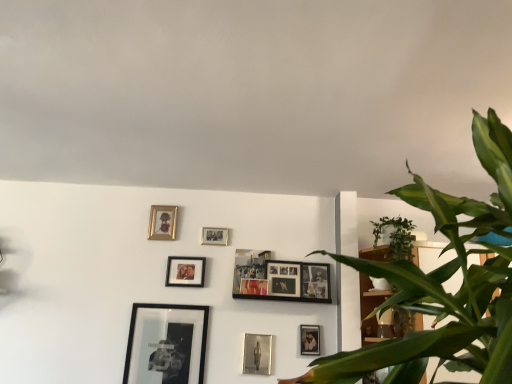
Question: Is matte black picture frame at center, which is the fifth picture frame in right-to-left order, with wooden frame at upper left, which appears as the 10th picture frame when viewed from the right?

Choices:
 (A) yes
 (B) no

Answer: (B)

Question: Is matte black picture frame at center, arranged as the 6th picture frame when viewed from the left, aimed at wooden frame at upper left, the first picture frame in the left-to-right sequence?

Choices:
 (A) yes
 (B) no

Answer: (B)

Question: Is matte black picture frame at center, which is the fifth picture frame in right-to-left order, oriented away from wooden frame at upper left, the first picture frame in the left-to-right sequence?

Choices:
 (A) no
 (B) yes

Answer: (A)

Question: Can you confirm if matte black picture frame at center, arranged as the 6th picture frame when viewed from the left, is thinner than wooden frame at upper left, the first picture frame in the left-to-right sequence?

Choices:
 (A) no
 (B) yes

Answer: (A)

Question: Can you confirm if matte black picture frame at center, arranged as the 6th picture frame when viewed from the left, is smaller than wooden frame at upper left, which appears as the 10th picture frame when viewed from the right?

Choices:
 (A) yes
 (B) no

Answer: (A)

Question: From a real-world perspective, relative to wooden frame at upper left, which appears as the 10th picture frame when viewed from the right, is matte black picture frame at center, which ranks as the 3th picture frame in left-to-right order, vertically above or below?

Choices:
 (A) above
 (B) below

Answer: (B)

Question: Does point (176, 279) appear closer or farther from the camera than point (159, 228)?

Choices:
 (A) farther
 (B) closer

Answer: (B)

Question: Considering their positions, is matte black picture frame at center, the eighth picture frame in the right-to-left sequence, located in front of or behind wooden frame at upper left, which appears as the 10th picture frame when viewed from the right?

Choices:
 (A) front
 (B) behind

Answer: (A)

Question: Visually, is matte black picture frame at center, which ranks as the 3th picture frame in left-to-right order, positioned to the left or to the right of wooden frame at upper left, the first picture frame in the left-to-right sequence?

Choices:
 (A) left
 (B) right

Answer: (B)

Question: Considering the positions of metallic silver photo frame at lower center, the seventh picture frame in the left-to-right sequence, and wooden photo frame at center, the 3th picture frame positioned from the right, in the image, is metallic silver photo frame at lower center, the seventh picture frame in the left-to-right sequence, bigger or smaller than wooden photo frame at center, the 3th picture frame positioned from the right,?

Choices:
 (A) small
 (B) big

Answer: (A)

Question: Is point (245, 334) positioned closer to the camera than point (274, 276)?

Choices:
 (A) farther
 (B) closer

Answer: (B)

Question: Looking at their shapes, would you say metallic silver photo frame at lower center, the seventh picture frame in the left-to-right sequence, is wider or thinner than wooden photo frame at center, the eighth picture frame when ordered from left to right?

Choices:
 (A) wide
 (B) thin

Answer: (B)

Question: Is metallic silver photo frame at lower center, which is the fourth picture frame from right to left, situated inside wooden photo frame at center, the 3th picture frame positioned from the right, or outside?

Choices:
 (A) inside
 (B) outside

Answer: (B)

Question: Looking at their shapes, would you say wooden photo frame at center, the 3th picture frame positioned from the right, is wider or thinner than wooden bookshelf at right?

Choices:
 (A) thin
 (B) wide

Answer: (A)

Question: Is wooden photo frame at center, the 3th picture frame positioned from the right, inside or outside of wooden bookshelf at right?

Choices:
 (A) outside
 (B) inside

Answer: (A)